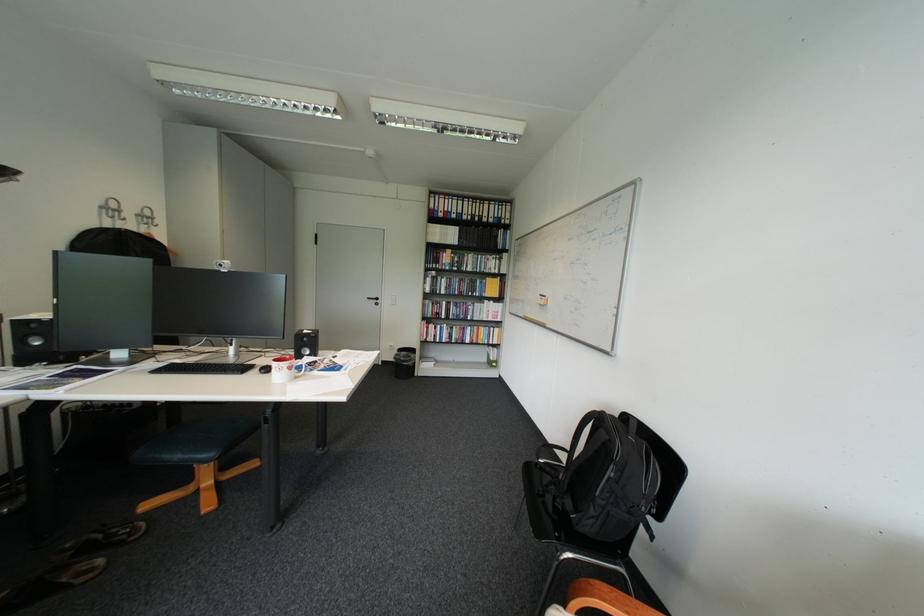
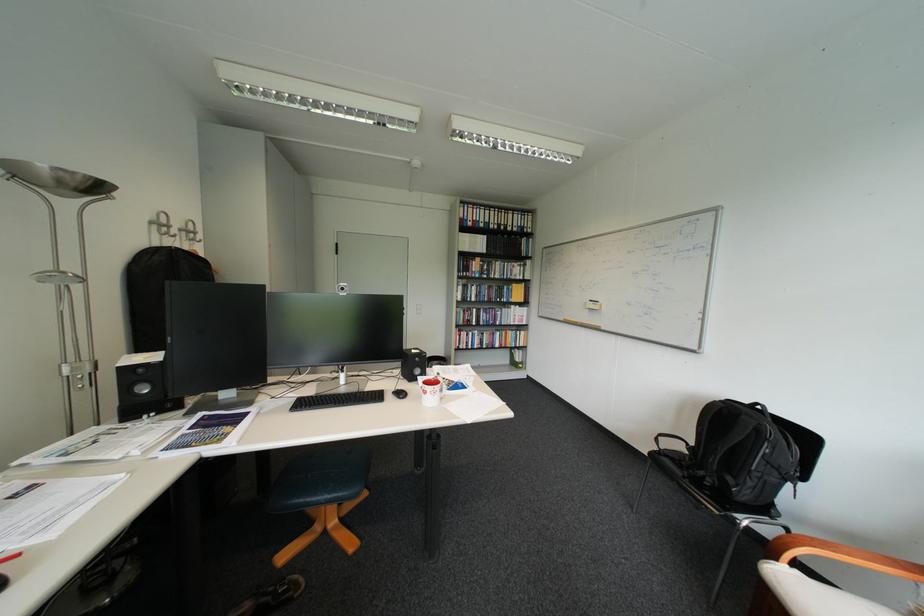
Where in the second image is the point corresponding to [137,220] from the first image?

(187, 237)